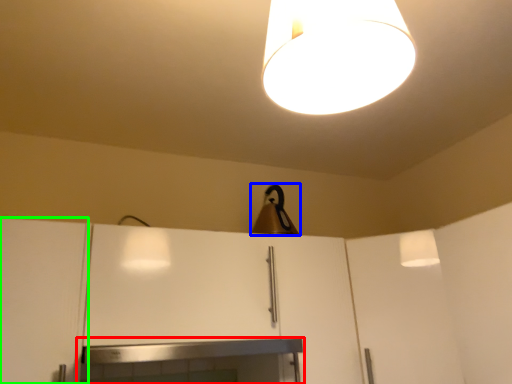
Question: Which object is positioned closest to fireplace (highlighted by a red box)? Select from lamp (highlighted by a blue box) and cabinetry (highlighted by a green box).

Choices:
 (A) lamp
 (B) cabinetry

Answer: (B)